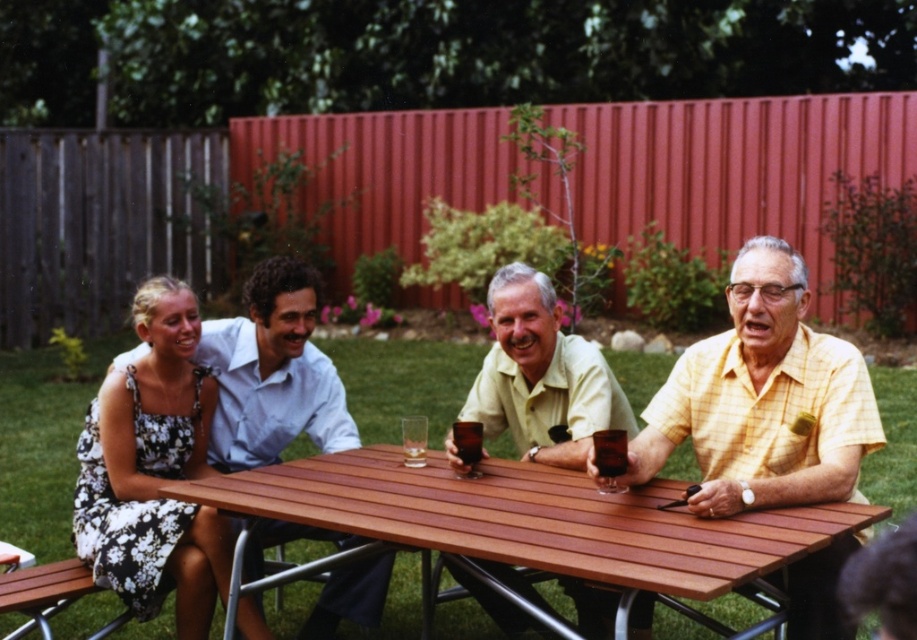
Question: Considering the real-world distances, which object is closest to the floral dress at left?

Choices:
 (A) white floral dress at left
 (B) yellow checkered shirt at right
 (C) yellow matte shirt at center

Answer: (B)

Question: Can you confirm if wooden table at center is smaller than yellow checkered shirt at right?

Choices:
 (A) no
 (B) yes

Answer: (A)

Question: From the image, what is the correct spatial relationship of yellow checkered shirt at right in relation to matte blue shirt at left?

Choices:
 (A) right
 (B) left

Answer: (A)

Question: Which point is closer to the camera?

Choices:
 (A) wooden table at center
 (B) yellow checkered shirt at right
 (C) translucent amber liquid at table center
 (D) floral dress at left

Answer: (A)

Question: Which object is closer to the camera taking this photo?

Choices:
 (A) yellow checkered shirt at right
 (B) brown glass at table center

Answer: (A)

Question: Can you confirm if wooden table at center is wider than translucent amber liquid at table center?

Choices:
 (A) no
 (B) yes

Answer: (B)